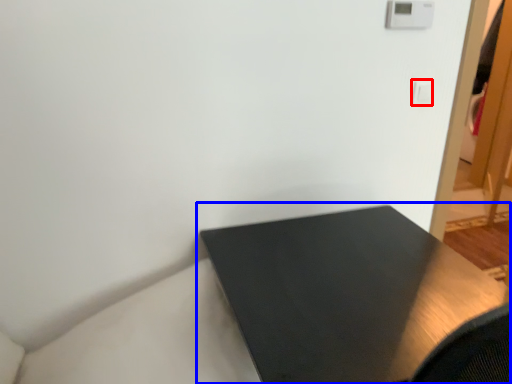
Question: Which object appears farthest to the camera in this image, light switch (highlighted by a red box) or table (highlighted by a blue box)?

Choices:
 (A) light switch
 (B) table

Answer: (A)